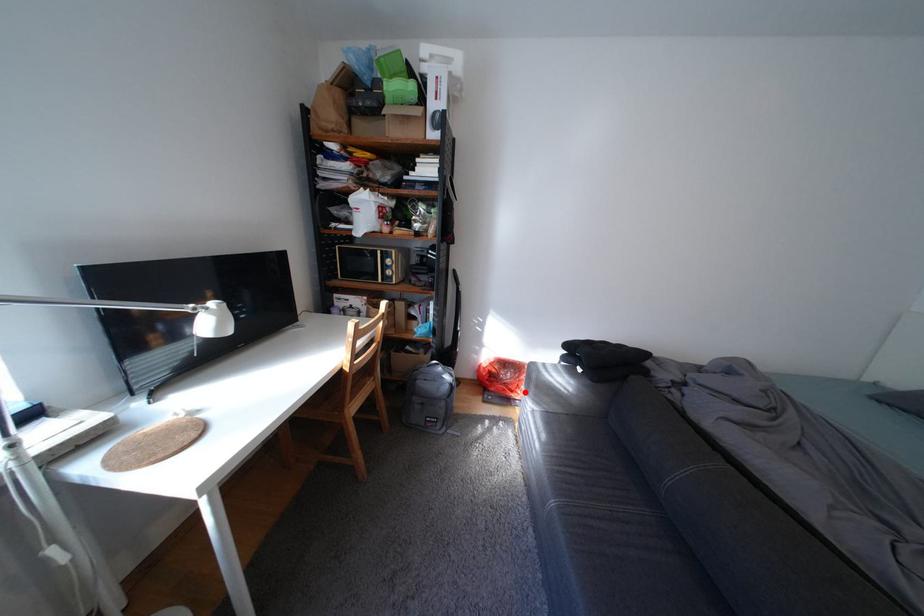
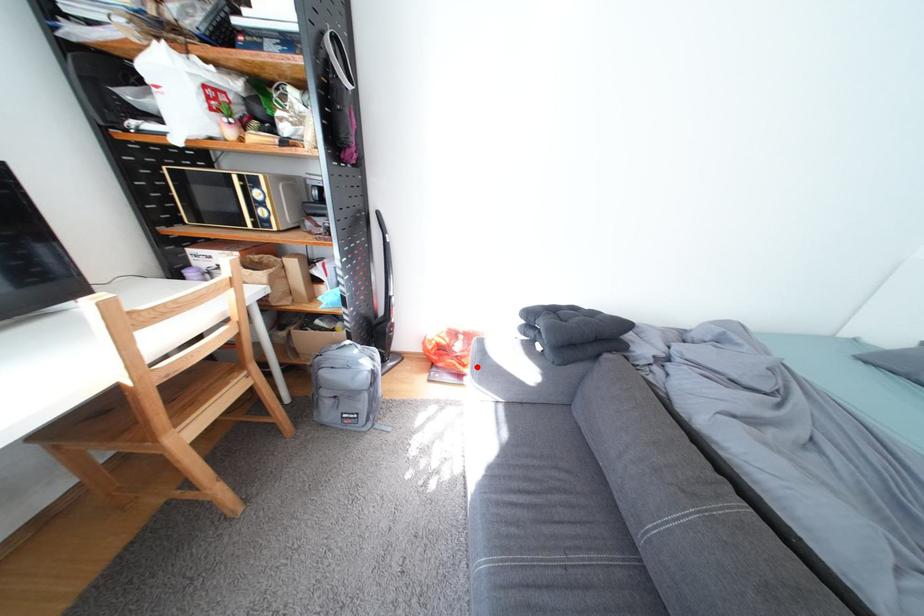
I am providing you with two images of the same scene from different viewpoints. A red point is marked on the first image and another point is marked on the second image. Do the highlighted points in image1 and image2 indicate the same real-world spot?

Yes